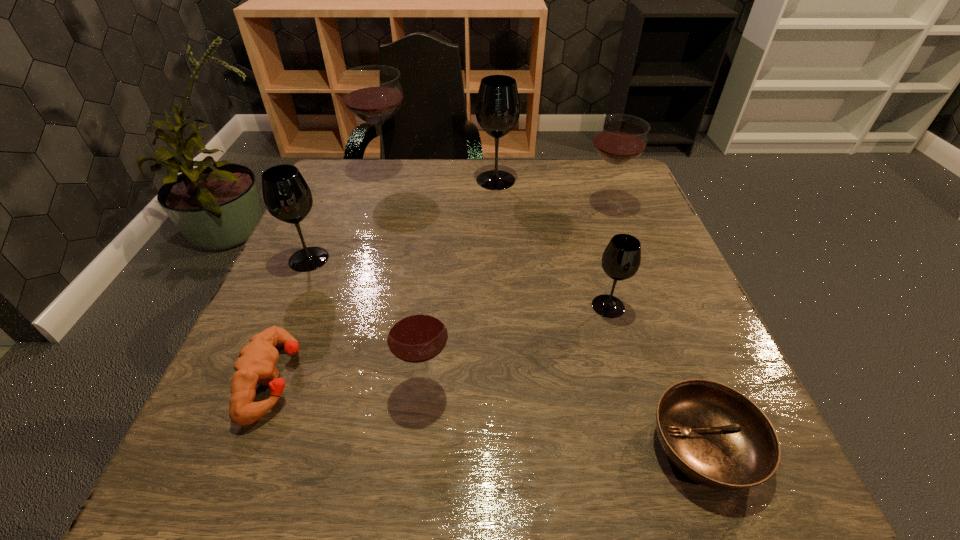
Locate an element on the screen. free space located on the right of the fifth farthest object is located at coordinates (694, 306).

I want to click on vacant area located 0.360m with the gloves of the seventh tallest object facing forward, so click(522, 380).

This screenshot has width=960, height=540. I want to click on free space located 0.380m on the left of the soup bowl, so click(383, 447).

The height and width of the screenshot is (540, 960). I want to click on object present at the near edge, so click(x=715, y=435).

This screenshot has width=960, height=540. I want to click on puncher located in the left edge section of the desktop, so click(x=256, y=364).

Where is `soup bowl that is at the right edge`? The image size is (960, 540). soup bowl that is at the right edge is located at coordinates (715, 435).

You are a GUI agent. You are given a task and a screenshot of the screen. Output one action in this format:
    pyautogui.click(x=<x>, y=<y>)
    Task: Click on the object positioned at the far left corner
    Image resolution: width=960 pixels, height=540 pixels.
    Given the screenshot: What is the action you would take?
    pyautogui.click(x=373, y=93)

The height and width of the screenshot is (540, 960). What are the coordinates of `object at the far right corner` in the screenshot? It's located at (620, 138).

This screenshot has height=540, width=960. In order to click on object positioned at the near right corner in this screenshot , I will do `click(715, 435)`.

The image size is (960, 540). In order to click on free spot at the far edge of the desktop in this screenshot , I will do `click(513, 170)`.